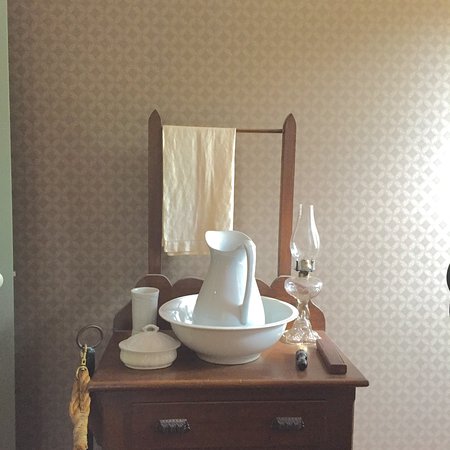
Where is `wooden cabinet with flat top`? wooden cabinet with flat top is located at coordinates (189, 376).